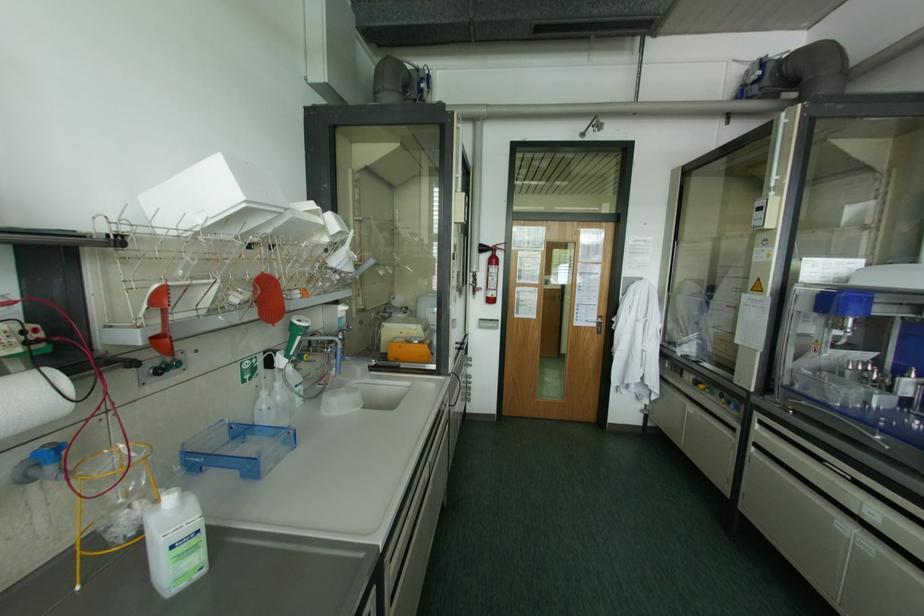
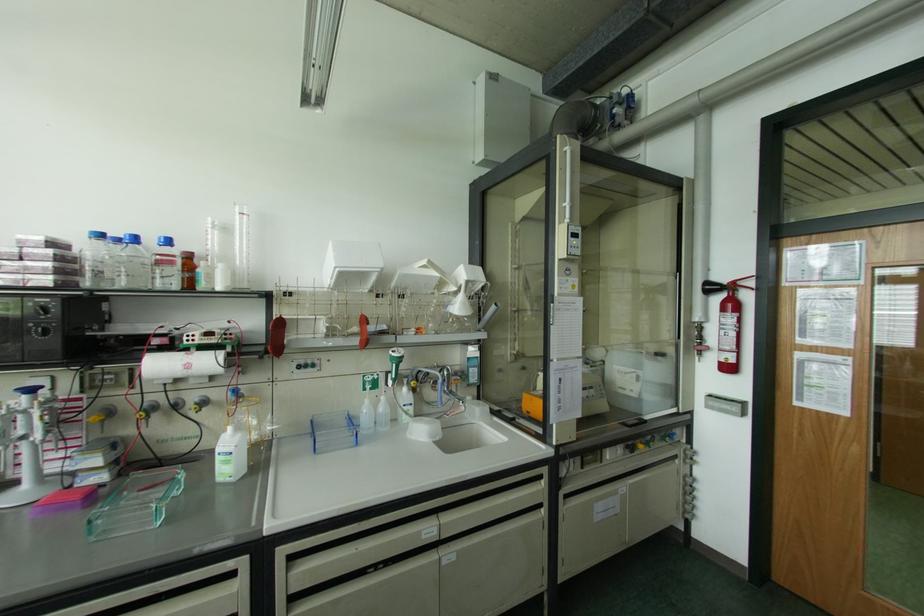
Where in the second image is the point corresponding to (x=276, y=383) from the first image?

(382, 398)